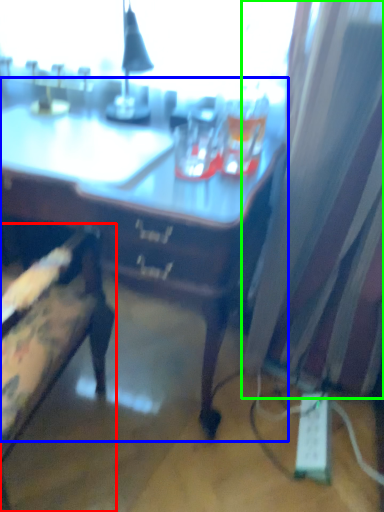
Question: Which object is the farthest from chair (highlighted by a red box)? Choose among these: desk (highlighted by a blue box) or curtain (highlighted by a green box).

Choices:
 (A) desk
 (B) curtain

Answer: (B)